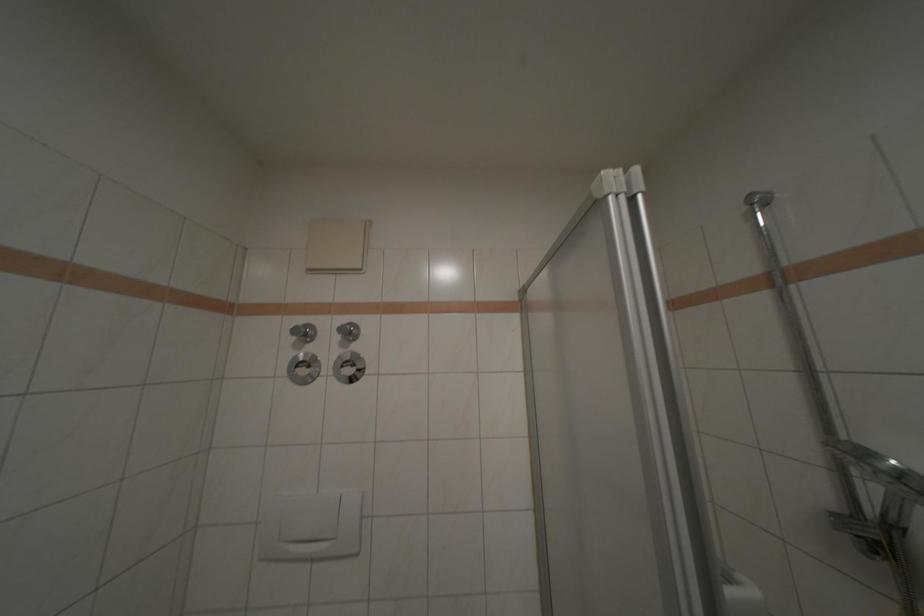
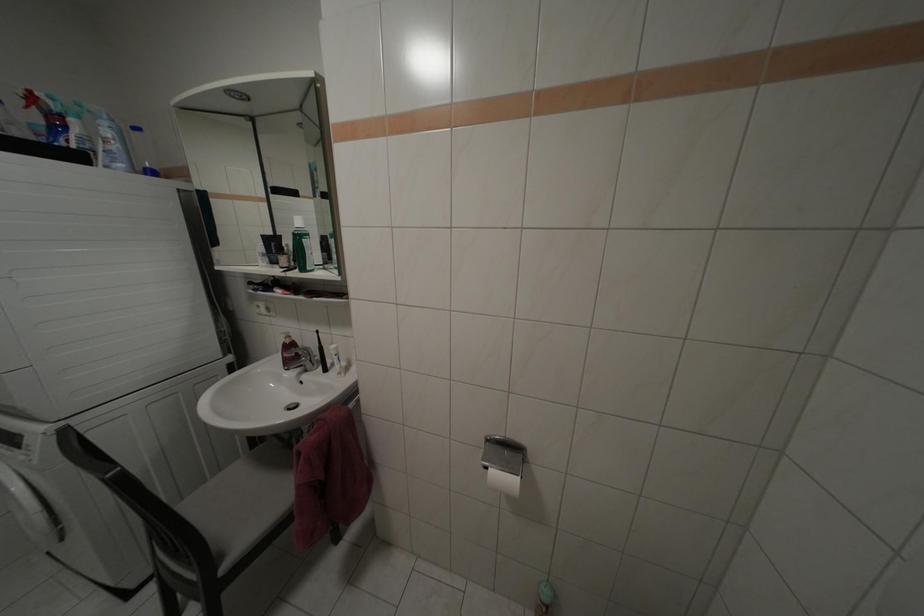
Question: The camera is either moving clockwise (left) or counter-clockwise (right) around the object. The first image is from the beginning of the video and the second image is from the end. Is the camera moving left or right when shooting the video?

Choices:
 (A) Left
 (B) Right

Answer: (B)